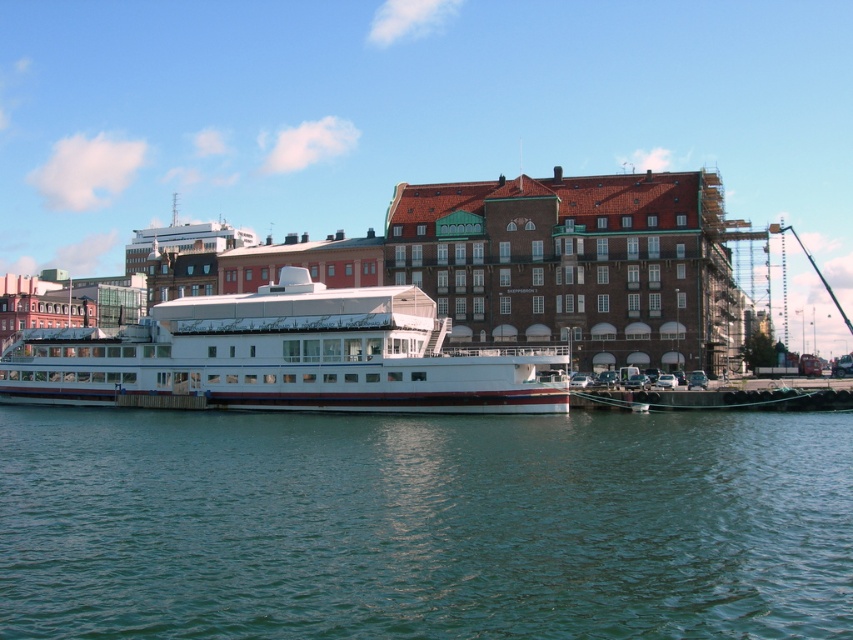
You are standing on the pier and want to board the white glossy boat at center. Which direction should you move to reach it from the green water at lower center?

The green water at lower center is located below the white glossy boat at center, so you should move upward to reach the boat from the water.

You are standing at the waterfront and see two points marked on the image. The first point is labeled as point (306, 621) and the second is point (524, 353). Which point is closer to you?

Point (306, 621) is in front of point (524, 353), so it is closer to you.

You are planning to organize a small picnic on the white glossy boat at center. The picnic requires a space wider than the boat itself. Can the green water at lower center provide enough space for this picnic?

The green water at lower center is wider than the white glossy boat at center, so it can provide enough space for the picnic.